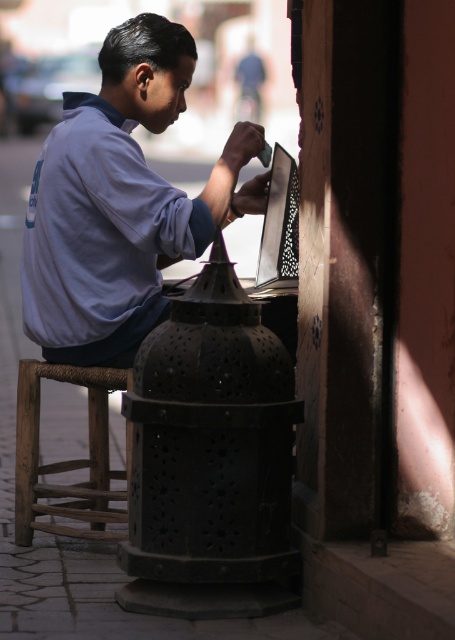
Question: Which object is the closest to the brown wooden stool at lower left?

Choices:
 (A) black metal lantern at center
 (B) matte black laptop at center

Answer: (B)

Question: Does black metal lantern at center lie behind brown wooden stool at lower left?

Choices:
 (A) no
 (B) yes

Answer: (A)

Question: Which object is positioned closest to the matte black laptop at center?

Choices:
 (A) matte blue shirt at center
 (B) black metal lantern at center
 (C) brown wooden stool at lower left

Answer: (A)

Question: Does black metal lantern at center have a lesser width compared to matte black laptop at center?

Choices:
 (A) no
 (B) yes

Answer: (A)

Question: Which object is the closest to the matte blue shirt at center?

Choices:
 (A) black metal lantern at center
 (B) brown wooden stool at lower left

Answer: (B)

Question: Can you confirm if brown wooden stool at lower left is bigger than matte black laptop at center?

Choices:
 (A) yes
 (B) no

Answer: (A)